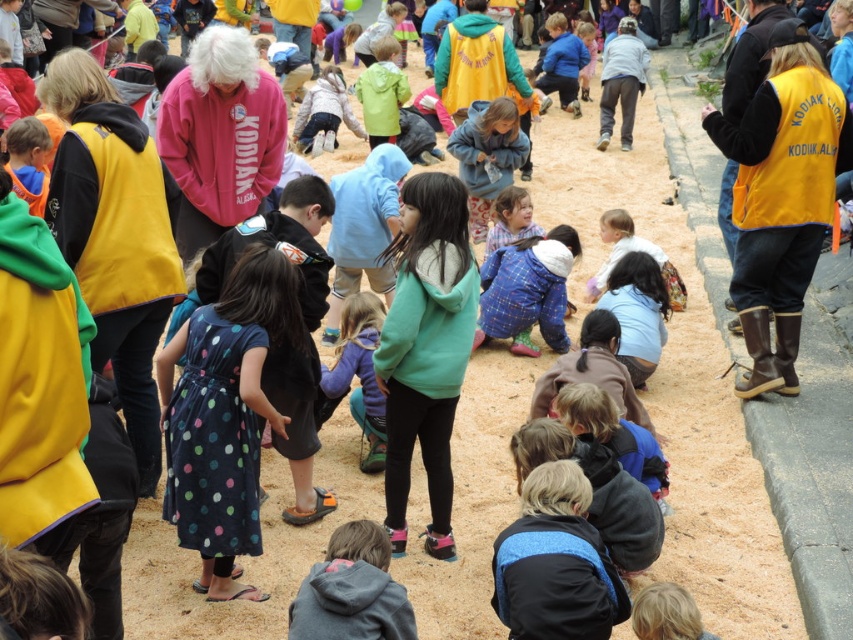
You are a photographer trying to capture a photo of the dark blue polka dot dress at center and the gray fleece hoodie at lower center. Based on their positions, which one is closer to the camera?

The gray fleece hoodie at lower center is closer to the camera because the dark blue polka dot dress at center is located above it, meaning it is positioned further away from the camera.

You are a photographer trying to capture both the blue plaid coat at center and the blue fleece jacket at center in a single shot. Since you want to ensure both are clearly visible, which clothing item should you focus on first to frame the shot properly?

The blue plaid coat at center is bigger than the blue fleece jacket at center, so you should focus on framing the blue plaid coat at center first to ensure it fits well in the frame before adjusting for the smaller blue fleece jacket at center.

You are a photographer trying to capture a candid shot of the children at the lively outdoor event. You notice the dark blue polka dot dress at center and the light blue fabric at center. Which object should you focus on if you want to photograph something that is taller?

The dark blue polka dot dress at center is taller than the light blue fabric at center, so you should focus on the dark blue polka dot dress at center.